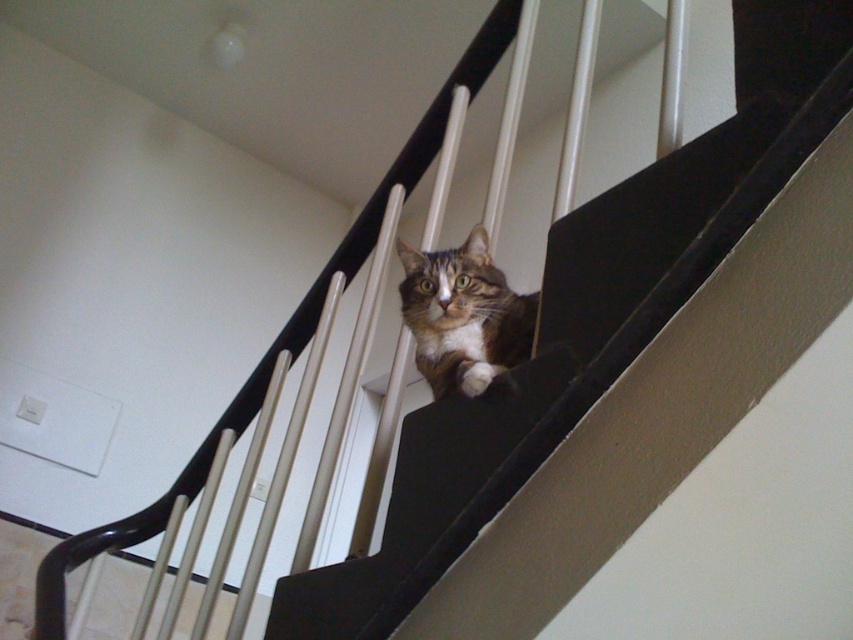
Question: Observing the image, what is the correct spatial positioning of brown furry cat at center in reference to brown fur cat at center?

Choices:
 (A) right
 (B) left

Answer: (A)

Question: Observing the image, what is the correct spatial positioning of brown furry cat at center in reference to brown fur cat at center?

Choices:
 (A) above
 (B) below

Answer: (B)

Question: Which point appears farthest from the camera in this image?

Choices:
 (A) (413, 529)
 (B) (468, 371)

Answer: (B)

Question: Is brown furry cat at center wider than brown fur cat at center?

Choices:
 (A) yes
 (B) no

Answer: (A)

Question: Which object appears closest to the camera in this image?

Choices:
 (A) brown fur cat at center
 (B) brown furry cat at center

Answer: (B)

Question: Which object appears closest to the camera in this image?

Choices:
 (A) brown furry cat at center
 (B) brown fur cat at center

Answer: (A)